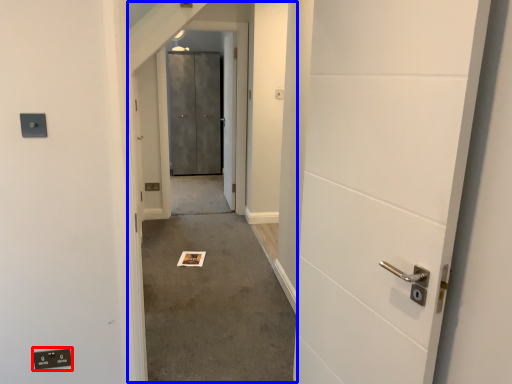
Question: Which object appears farthest to the camera in this image, electric outlet (highlighted by a red box) or corridor (highlighted by a blue box)?

Choices:
 (A) electric outlet
 (B) corridor

Answer: (A)